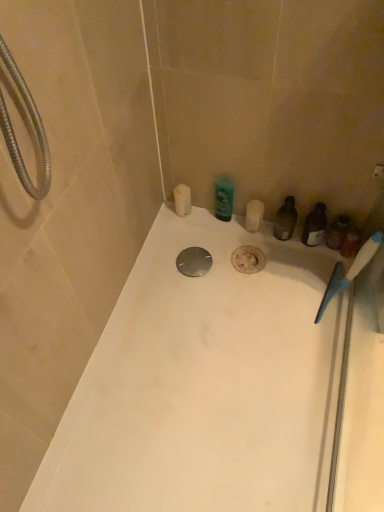
Locate an element on the screen. This screenshot has width=384, height=512. free space on the front side of translucent plastic bottle at right is located at coordinates (288, 279).